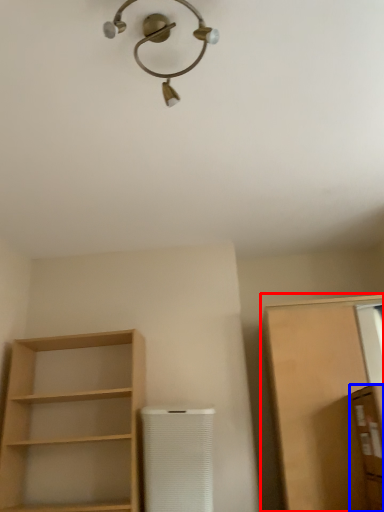
Question: Which of the following is the closest to the observer, cabinetry (highlighted by a red box) or cabinetry (highlighted by a blue box)?

Choices:
 (A) cabinetry
 (B) cabinetry

Answer: (B)